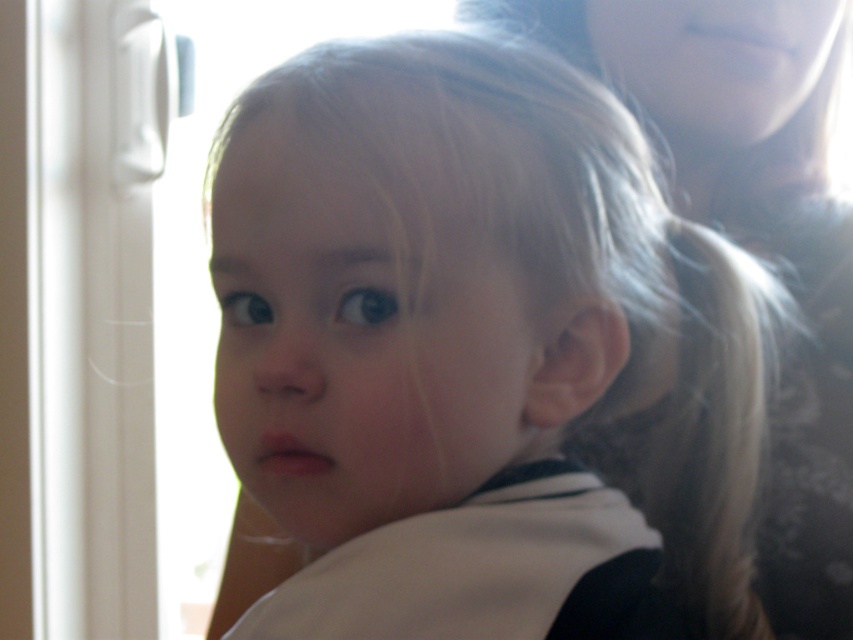
Who is lower down, smooth skin baby at center or smooth skin face at upper center?

smooth skin baby at center

Describe the element at coordinates (440, 339) in the screenshot. I see `smooth skin baby at center` at that location.

At what (x,y) coordinates should I click in order to perform the action: click on smooth skin baby at center. Please return your answer as a coordinate pair (x, y). This screenshot has width=853, height=640. Looking at the image, I should click on (440, 339).